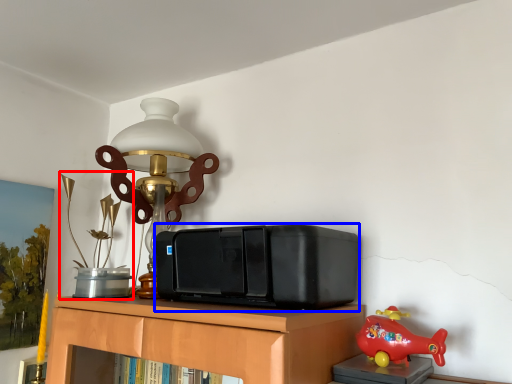
Question: Which point is closer to the camera, toy (highlighted by a red box) or stereo (highlighted by a blue box)?

Choices:
 (A) toy
 (B) stereo

Answer: (B)